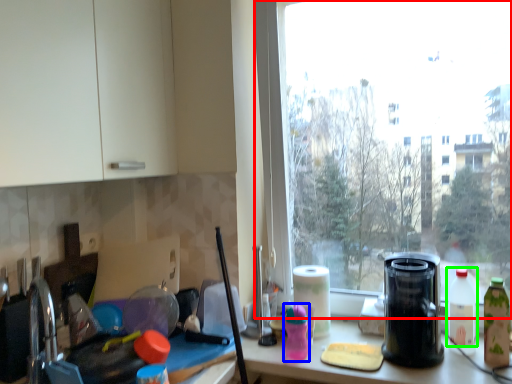
Question: Considering the real-world distances, which object is farthest from window (highlighted by a red box)? bottle (highlighted by a blue box) or bottle (highlighted by a green box)?

Choices:
 (A) bottle
 (B) bottle

Answer: (A)